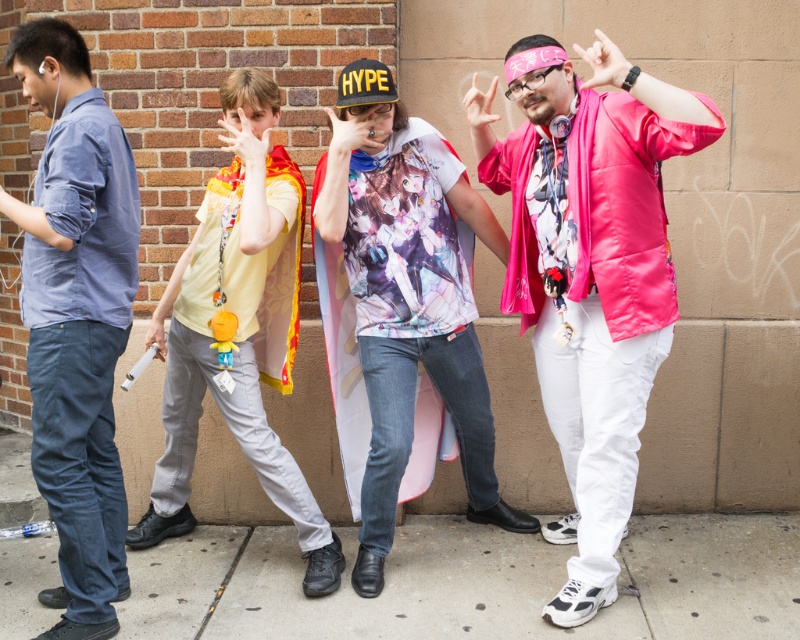
You are a delivery person who needs to place a small package between the concrete at lower center and the printed fabric shirt at center. Can you fit it there?

The distance between the concrete at lower center and the printed fabric shirt at center is 33.50 inches, so yes, the small package can fit there easily.

You are standing on the sidewalk in front of the brick wall. You want to place a small potted plant between the concrete at lower center and the printed fabric shirt at center. Which object should the plant be closer to?

The concrete at lower center is closer to the viewer than the printed fabric shirt at center, so the potted plant should be placed closer to the concrete at lower center to maintain the spatial relationship.

You are a delivery person who needs to place a small package on the ground. The scene has concrete at lower center and blue denim jeans at left. Which surface would be more suitable for placing the package?

The concrete at lower center is bigger than blue denim jeans at left, so it is more suitable for placing the small package.